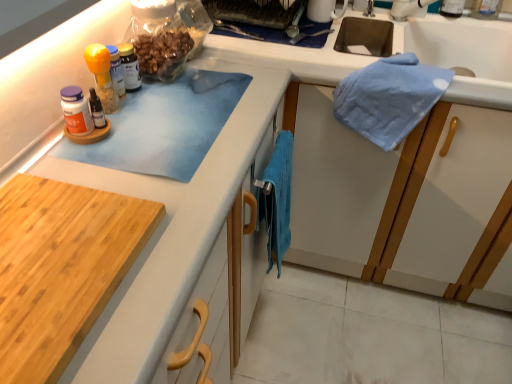
Question: From the image's perspective, is blue fabric towel at upper right above or below wooden cutting board at lower left?

Choices:
 (A) above
 (B) below

Answer: (A)

Question: Is point (465, 46) closer or farther from the camera than point (64, 354)?

Choices:
 (A) closer
 (B) farther

Answer: (B)

Question: Estimate the real-world distances between objects in this image. Which object is farther from the blue cotton towel at center?

Choices:
 (A) blue fabric towel at upper right
 (B) translucent plastic bottle at center
 (C) wooden cutting board at lower left

Answer: (A)

Question: Which of these objects is positioned closest to the wooden cutting board at lower left?

Choices:
 (A) translucent plastic bottle at center
 (B) blue fabric towel at upper right
 (C) blue cotton towel at center

Answer: (C)